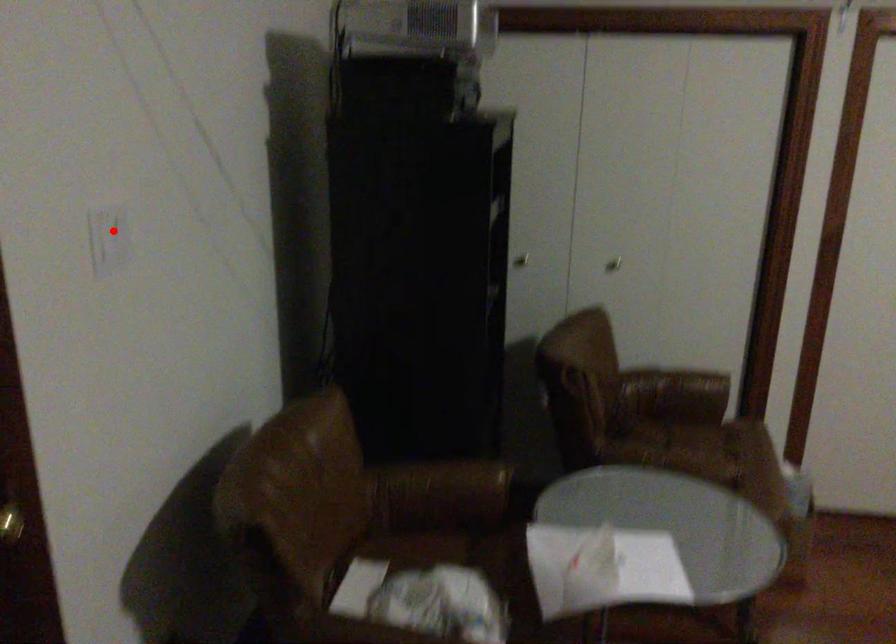
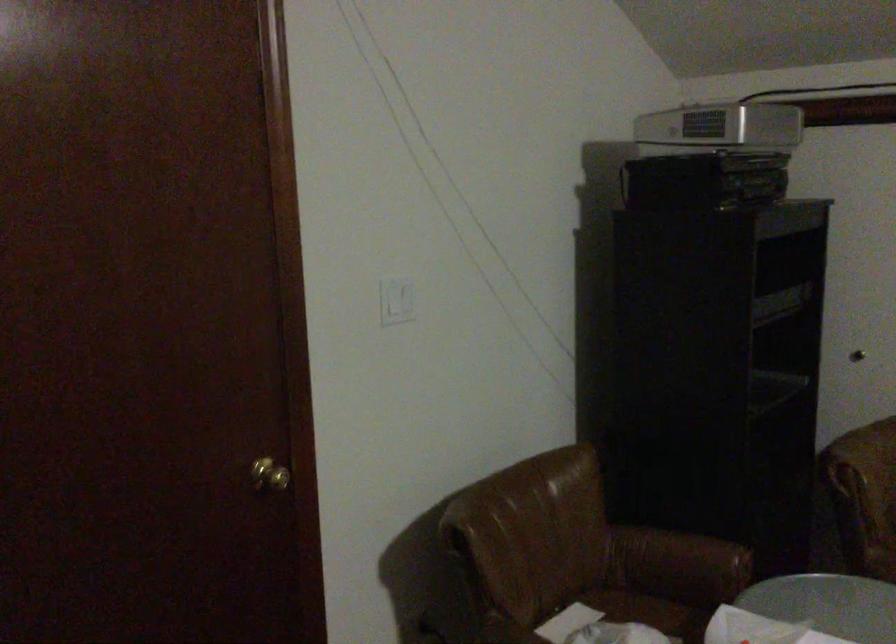
Question: A red point is marked in image1. In image2, is the corresponding 3D point closer to the camera or farther? Reply with the corresponding letter.

Choices:
 (A) The corresponding 3D point is closer.
 (B) The corresponding 3D point is farther.

Answer: (B)